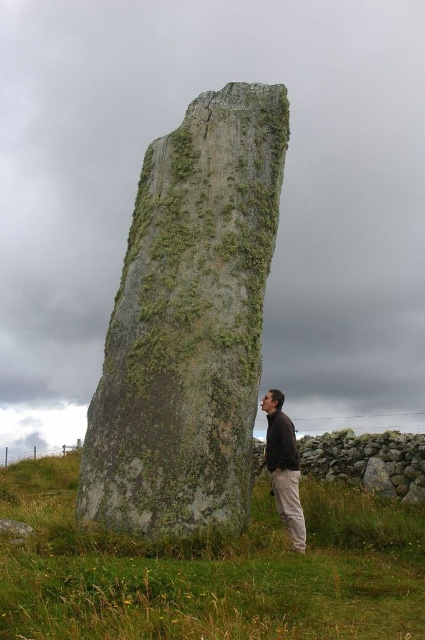
Is green mossy stone at center below green grassy at lower center?

No.

Can you confirm if green mossy stone at center is shorter than green grassy at lower center?

No, green mossy stone at center is not shorter than green grassy at lower center.

Who is more distant from viewer, (231,188) or (263,548)?

The point (231,188) is more distant.

This screenshot has height=640, width=425. What are the coordinates of `green mossy stone at center` in the screenshot? It's located at (189, 323).

Can you confirm if green grassy at lower center is shorter than dark brown leather jacket at lower right?

Indeed, green grassy at lower center has a lesser height compared to dark brown leather jacket at lower right.

Which of these two, green grassy at lower center or dark brown leather jacket at lower right, stands taller?

With more height is dark brown leather jacket at lower right.

Does point (294, 614) come farther from viewer compared to point (269, 401)?

No.

Where is `green grassy at lower center`? The image size is (425, 640). green grassy at lower center is located at coordinates (209, 570).

Who is more distant from viewer, (223, 404) or (294, 483)?

The point (294, 483) is behind.

Is point (192, 195) in front of point (291, 515)?

No, it is behind (291, 515).

Does point (189, 154) come in front of point (300, 509)?

That is False.

Image resolution: width=425 pixels, height=640 pixels. I want to click on green mossy stone at center, so click(x=189, y=323).